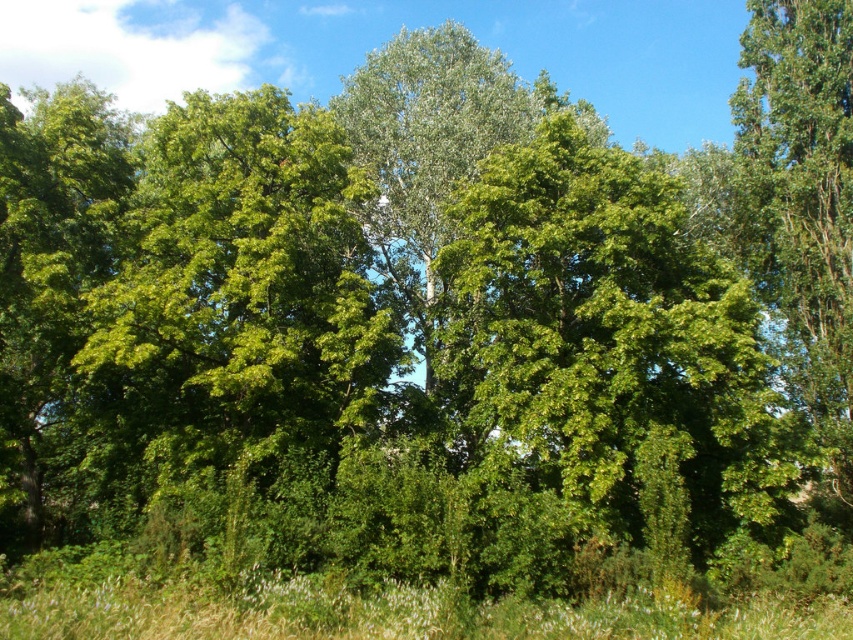
Question: Which object appears closest to the camera in this image?

Choices:
 (A) green leafy tree at right
 (B) green grassy at lower center

Answer: (B)

Question: Among these objects, which one is farthest from the camera?

Choices:
 (A) green leafy tree at right
 (B) green grassy at lower center
 (C) green leafy tree at center

Answer: (A)

Question: Is green leafy tree at center thinner than green leafy tree at right?

Choices:
 (A) no
 (B) yes

Answer: (A)

Question: Considering the relative positions of green grassy at lower center and green leafy tree at right in the image provided, where is green grassy at lower center located with respect to green leafy tree at right?

Choices:
 (A) above
 (B) below

Answer: (B)

Question: Does green grassy at lower center appear under green leafy tree at right?

Choices:
 (A) yes
 (B) no

Answer: (A)

Question: Which point is farther to the camera?

Choices:
 (A) green grassy at lower center
 (B) green leafy tree at right

Answer: (B)